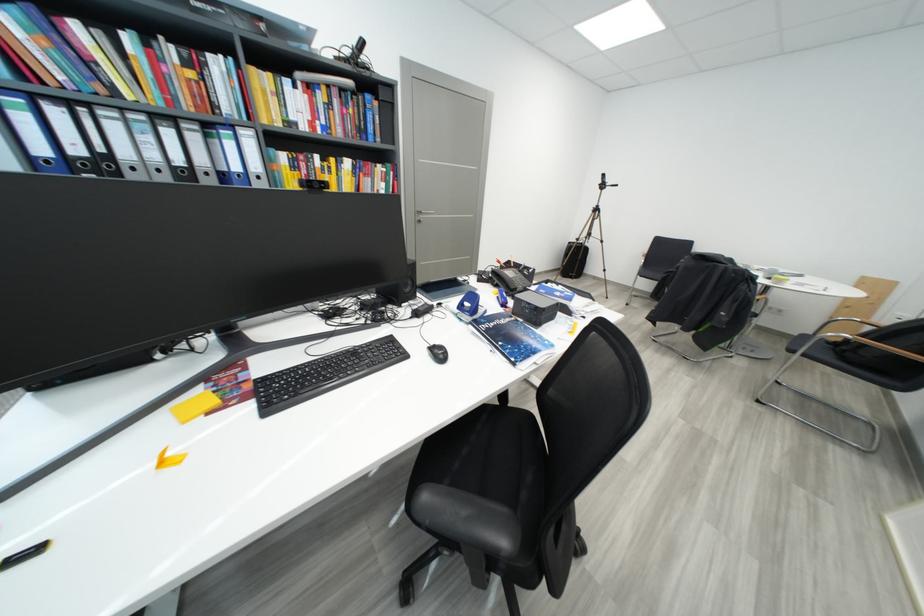
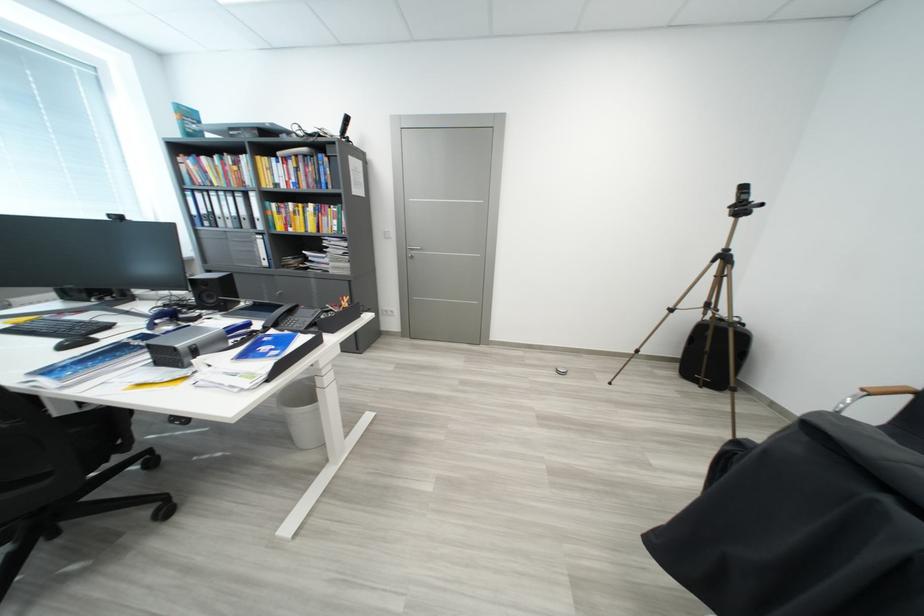
Where in the second image is the point corresponding to [416,288] from the first image?

(220, 300)